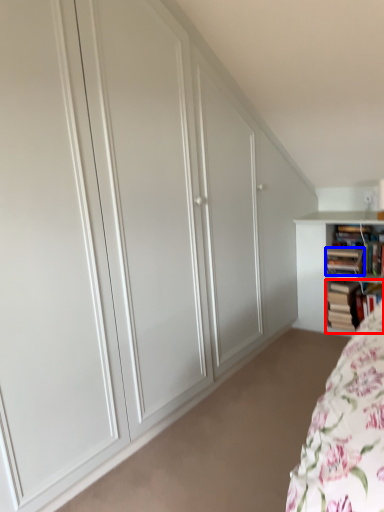
Question: Which point is closer to the camera, book (highlighted by a red box) or book (highlighted by a blue box)?

Choices:
 (A) book
 (B) book

Answer: (B)